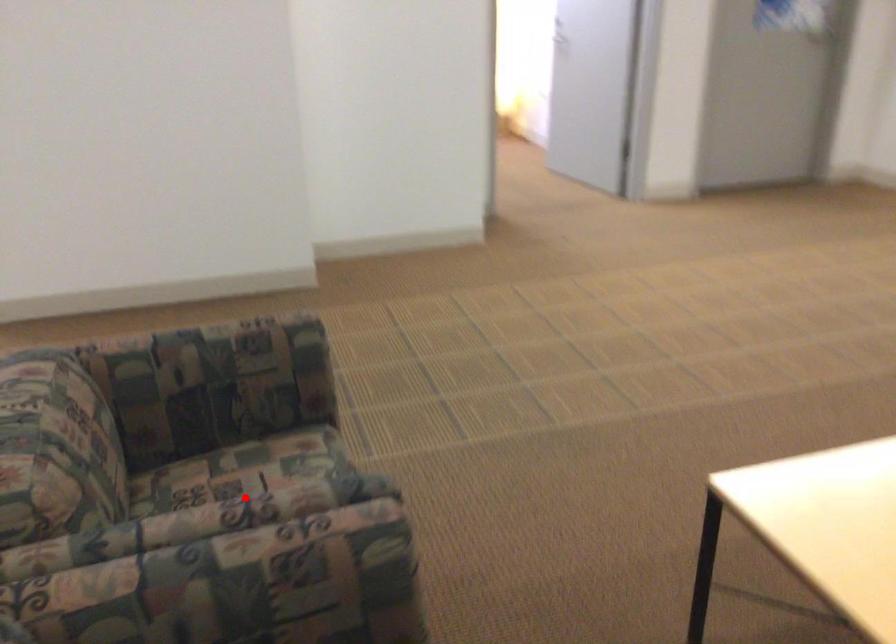
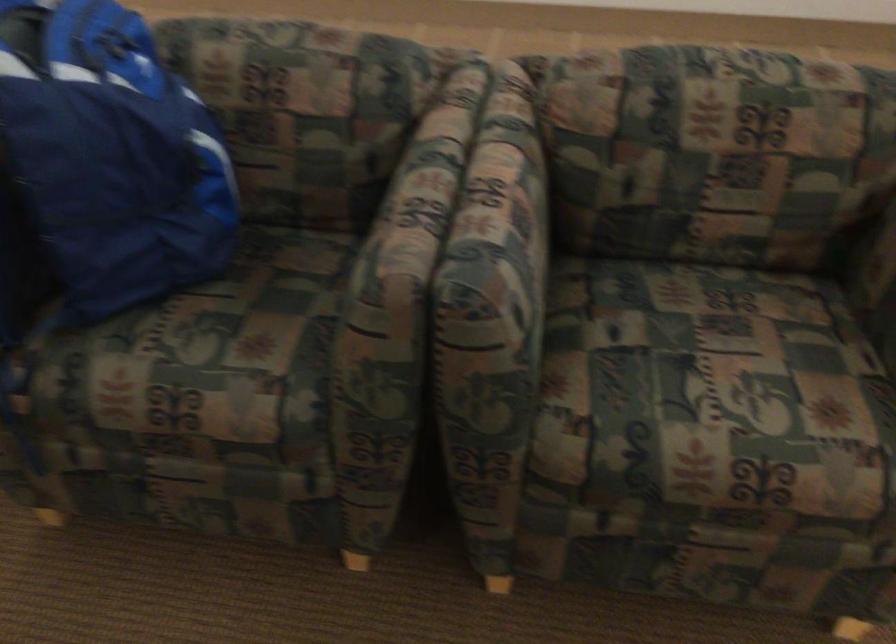
The point at the highlighted location is marked in the first image. Where is the corresponding point in the second image?

(510, 196)